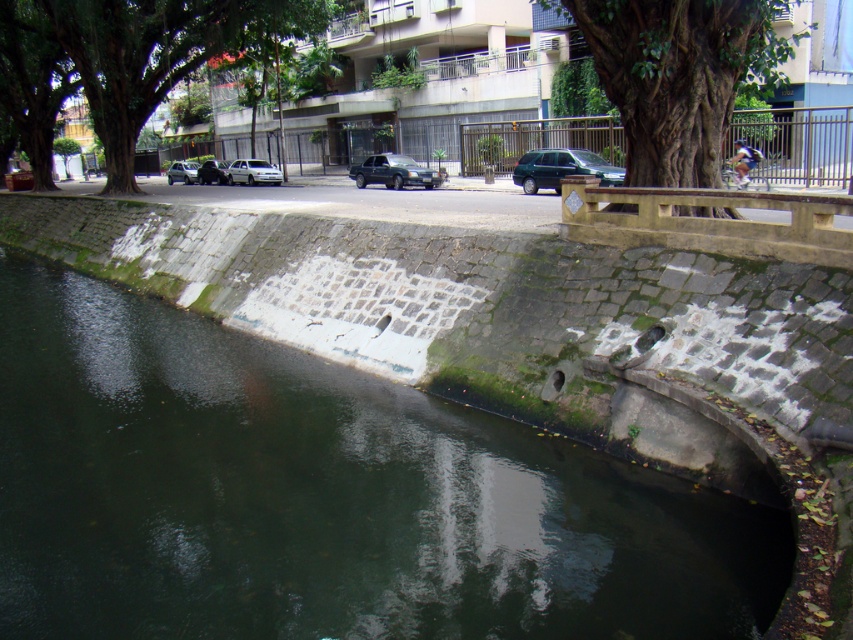
Where is `green leafy tree at upper left`? This screenshot has width=853, height=640. green leafy tree at upper left is located at coordinates (131, 56).

Who is positioned more to the left, green leafy tree at upper left or metallic green suv at center right?

From the viewer's perspective, green leafy tree at upper left appears more on the left side.

The width and height of the screenshot is (853, 640). Identify the location of green leafy tree at upper left. [131, 56].

Locate an element on the screen. This screenshot has height=640, width=853. green leafy tree at upper left is located at coordinates (131, 56).

Between shiny dark blue sedan at center and silver metallic car at left, which one is positioned higher?

silver metallic car at left

Between point (392, 177) and point (167, 179), which one is positioned in front?

Point (392, 177)

The height and width of the screenshot is (640, 853). Find the location of `shiny dark blue sedan at center`. shiny dark blue sedan at center is located at coordinates (393, 172).

Which of these two, shiny silver sedan at center or silver metallic car at left, stands taller?

silver metallic car at left

Measure the distance between shiny silver sedan at center and camera.

shiny silver sedan at center and camera are 42.84 meters apart from each other.

The width and height of the screenshot is (853, 640). I want to click on shiny silver sedan at center, so click(x=212, y=172).